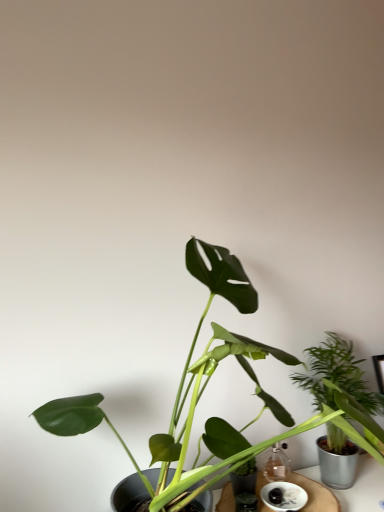
Question: Does green leafy plant at right, which is the 2th houseplant in front-to-back order, have a greater width compared to green matte leafy plant at center, marked as the first houseplant in a front-to-back arrangement?

Choices:
 (A) yes
 (B) no

Answer: (B)

Question: Is green leafy plant at right, arranged as the 1th houseplant when viewed from the back, not near green matte leafy plant at center, placed as the 2th houseplant when sorted from back to front?

Choices:
 (A) no
 (B) yes

Answer: (A)

Question: Is green leafy plant at right, arranged as the 1th houseplant when viewed from the back, further to the viewer compared to green matte leafy plant at center, placed as the 2th houseplant when sorted from back to front?

Choices:
 (A) yes
 (B) no

Answer: (A)

Question: Can you confirm if green leafy plant at right, which is the 2th houseplant in front-to-back order, is thinner than green matte leafy plant at center, marked as the first houseplant in a front-to-back arrangement?

Choices:
 (A) yes
 (B) no

Answer: (A)

Question: Considering the relative positions of green leafy plant at right, arranged as the 1th houseplant when viewed from the back, and green matte leafy plant at center, marked as the first houseplant in a front-to-back arrangement, in the image provided, is green leafy plant at right, arranged as the 1th houseplant when viewed from the back, in front of green matte leafy plant at center, marked as the first houseplant in a front-to-back arrangement,?

Choices:
 (A) no
 (B) yes

Answer: (A)

Question: In terms of size, does white ceramic saucer at lower center appear bigger or smaller than green leafy plant at right, arranged as the 1th houseplant when viewed from the back?

Choices:
 (A) big
 (B) small

Answer: (B)

Question: In terms of height, does white ceramic saucer at lower center look taller or shorter compared to green leafy plant at right, which is the 2th houseplant in front-to-back order?

Choices:
 (A) tall
 (B) short

Answer: (B)

Question: Is white ceramic saucer at lower center in front of or behind green leafy plant at right, arranged as the 1th houseplant when viewed from the back, in the image?

Choices:
 (A) behind
 (B) front

Answer: (B)

Question: From a real-world perspective, is white ceramic saucer at lower center above or below green leafy plant at right, arranged as the 1th houseplant when viewed from the back?

Choices:
 (A) above
 (B) below

Answer: (B)

Question: Considering the positions of point (331, 502) and point (263, 500), is point (331, 502) closer or farther from the camera than point (263, 500)?

Choices:
 (A) farther
 (B) closer

Answer: (B)

Question: In terms of height, does wooden table at center look taller or shorter compared to white ceramic saucer at lower center?

Choices:
 (A) tall
 (B) short

Answer: (A)

Question: From the image's perspective, is wooden table at center located above or below white ceramic saucer at lower center?

Choices:
 (A) above
 (B) below

Answer: (B)

Question: Would you say wooden table at center is to the left or to the right of white ceramic saucer at lower center in the picture?

Choices:
 (A) left
 (B) right

Answer: (A)

Question: Based on their sizes in the image, would you say green leafy plant at right, arranged as the 1th houseplant when viewed from the back, is bigger or smaller than white ceramic saucer at lower center?

Choices:
 (A) big
 (B) small

Answer: (A)

Question: From a real-world perspective, is green leafy plant at right, which is the 2th houseplant in front-to-back order, above or below white ceramic saucer at lower center?

Choices:
 (A) above
 (B) below

Answer: (A)